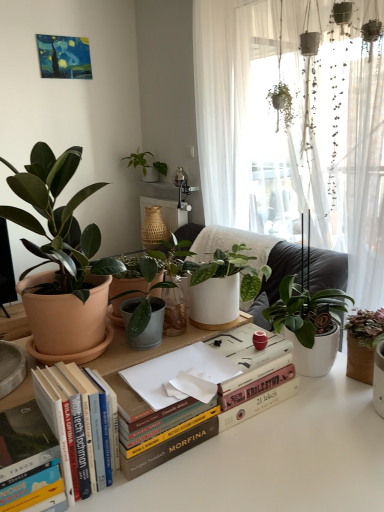
Question: Does hardcover book at lower left, the second paperback book viewed from the top, have a lesser width compared to green matte plant at upper center, marked as the first houseplant in a left-to-right arrangement?

Choices:
 (A) no
 (B) yes

Answer: (B)

Question: Could you tell me if hardcover book at lower left, the 1th paperback book from the bottom, is facing green matte plant at upper center, which ranks as the third houseplant in front-to-back order?

Choices:
 (A) yes
 (B) no

Answer: (B)

Question: From a real-world perspective, is hardcover book at lower left, acting as the 2th paperback book starting from the right, below green matte plant at upper center, which is counted as the first houseplant, starting from the back?

Choices:
 (A) no
 (B) yes

Answer: (B)

Question: From a real-world perspective, is hardcover book at lower left, which is the 1th paperback book in left-to-right order, over green matte plant at upper center, marked as the 3th houseplant in a bottom-to-top arrangement?

Choices:
 (A) yes
 (B) no

Answer: (B)

Question: Considering the relative sizes of hardcover book at lower left, acting as the 2th paperback book starting from the right, and green matte plant at upper center, marked as the first houseplant in a left-to-right arrangement, in the image provided, is hardcover book at lower left, acting as the 2th paperback book starting from the right, wider than green matte plant at upper center, marked as the first houseplant in a left-to-right arrangement,?

Choices:
 (A) no
 (B) yes

Answer: (A)

Question: Does hardcover book at lower left, the second paperback book viewed from the top, come in front of green matte plant at upper center, the 3th houseplant viewed from the right?

Choices:
 (A) yes
 (B) no

Answer: (A)

Question: Considering the relative sizes of hardcover books at center and white paper at center, which is counted as the second paperback book, starting from the bottom, in the image provided, is hardcover books at center shorter than white paper at center, which is counted as the second paperback book, starting from the bottom,?

Choices:
 (A) no
 (B) yes

Answer: (A)

Question: Is white paper at center, which is counted as the second paperback book, starting from the bottom, a part of hardcover books at center?

Choices:
 (A) yes
 (B) no

Answer: (B)

Question: Is hardcover books at center positioned with its back to white paper at center, which appears as the 1th paperback book when viewed from the right?

Choices:
 (A) yes
 (B) no

Answer: (B)

Question: Is hardcover books at center smaller than white paper at center, marked as the 1th paperback book in a top-to-bottom arrangement?

Choices:
 (A) yes
 (B) no

Answer: (B)

Question: Is hardcover books at center taller than white paper at center, the 2th paperback book viewed from the left?

Choices:
 (A) no
 (B) yes

Answer: (B)

Question: Considering the relative positions of hardcover books at center and white paper at center, marked as the 1th paperback book in a top-to-bottom arrangement, in the image provided, is hardcover books at center in front of white paper at center, marked as the 1th paperback book in a top-to-bottom arrangement,?

Choices:
 (A) yes
 (B) no

Answer: (A)

Question: Is hardcover books at center smaller than green matte plant at right, placed as the 2th houseplant when sorted from front to back?

Choices:
 (A) no
 (B) yes

Answer: (B)